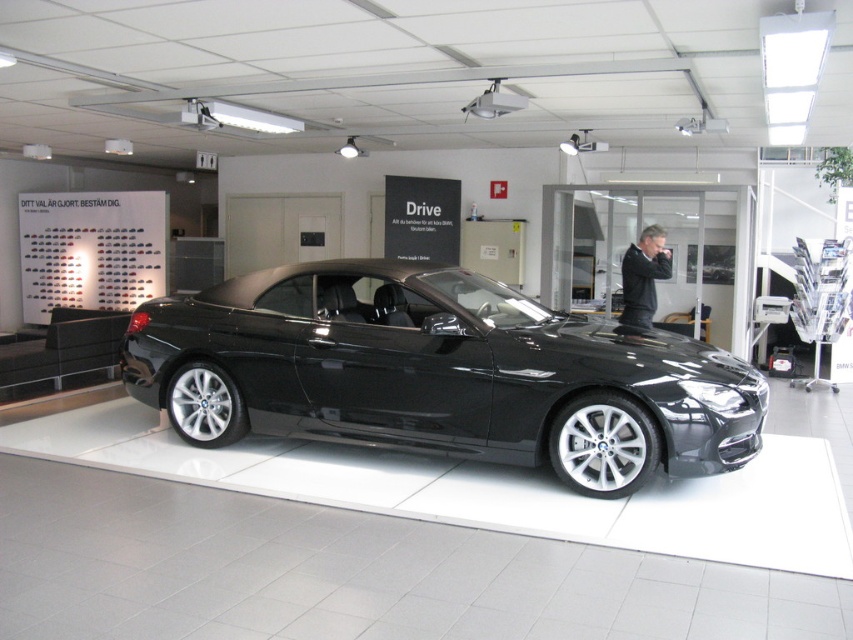
You are a customer in the showroom and want to place the black leather jacket at center on the hood of the glossy black convertible at center. Based on their sizes, will the jacket fit entirely on the hood without overlapping the edges?

The glossy black convertible at center is larger than the black leather jacket at center, so the jacket will fit entirely on the hood without overlapping the edges.

You are standing in the showroom and see two points marked on the floor. The first point is at point (241,284) and the second point is at point (648,241). Which point is closer to you?

Point (241,284) is in front of point (648,241), so it is closer to you.

You are standing in the showroom and want to take a closer look at the glossy black convertible at center. The security guard says you must stay at least 3 meters away from the car. Are you currently within the allowed distance?

The distance between you and the glossy black convertible at center is 4.66 meters, which is more than the required 3 meters, so you are within the allowed distance.